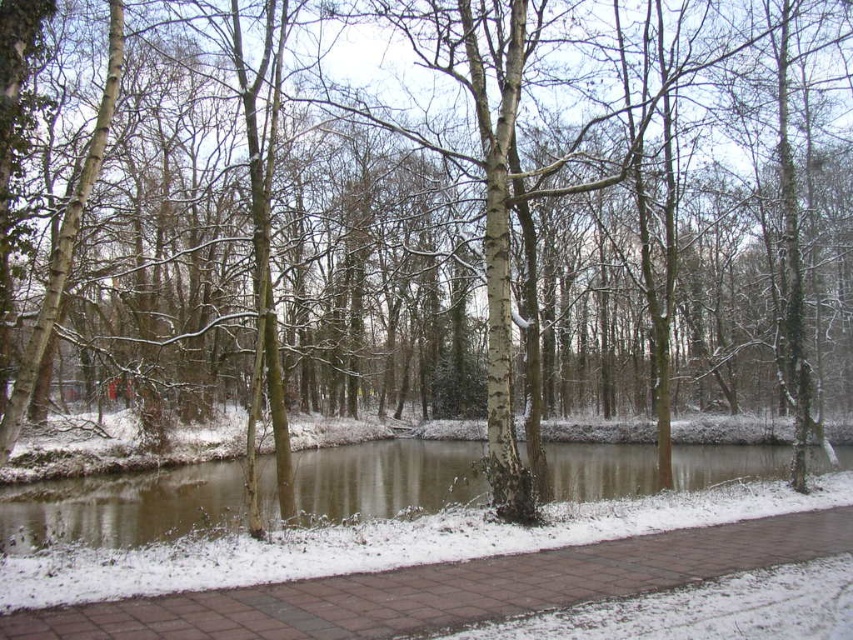
Question: Among these points, which one is farthest from the camera?

Choices:
 (A) (705, 541)
 (B) (680, 477)

Answer: (B)

Question: Can you confirm if brick paved path at center is bigger than snowy water at center?

Choices:
 (A) yes
 (B) no

Answer: (B)

Question: Observing the image, what is the correct spatial positioning of brick paved path at center in reference to snowy water at center?

Choices:
 (A) below
 (B) above

Answer: (B)

Question: Among these objects, which one is farthest from the camera?

Choices:
 (A) snowy water at center
 (B) brick paved path at center

Answer: (B)

Question: Does brick paved path at center appear over snowy water at center?

Choices:
 (A) no
 (B) yes

Answer: (B)